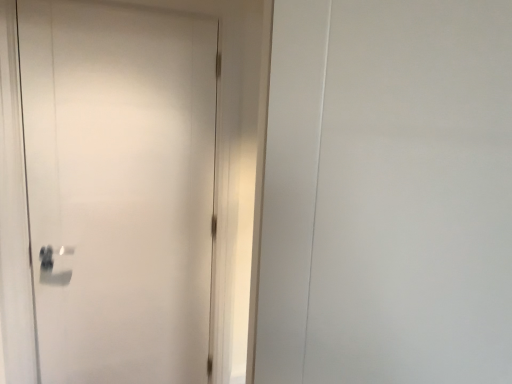
You are a GUI agent. You are given a task and a screenshot of the screen. Output one action in this format:
    pyautogui.click(x=<x>, y=<y>)
    Task: Click on the white matte door at left
    The width and height of the screenshot is (512, 384).
    Given the screenshot: What is the action you would take?
    pyautogui.click(x=119, y=188)

Image resolution: width=512 pixels, height=384 pixels. Describe the element at coordinates (119, 188) in the screenshot. I see `white matte door at left` at that location.

The image size is (512, 384). What are the coordinates of `white matte door at left` in the screenshot? It's located at (119, 188).